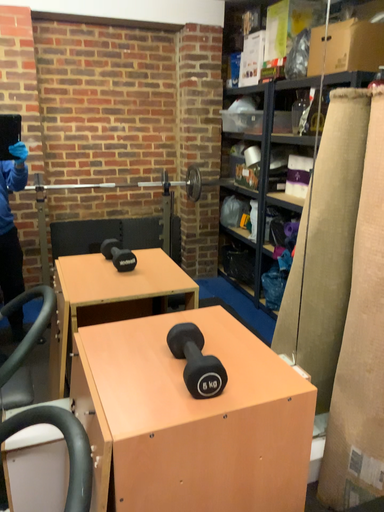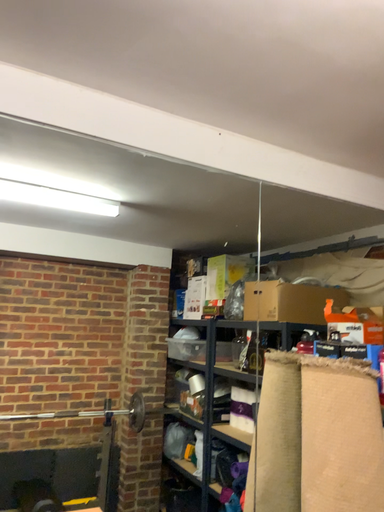
Question: Which way did the camera rotate in the video?

Choices:
 (A) rotated upward
 (B) rotated downward

Answer: (A)